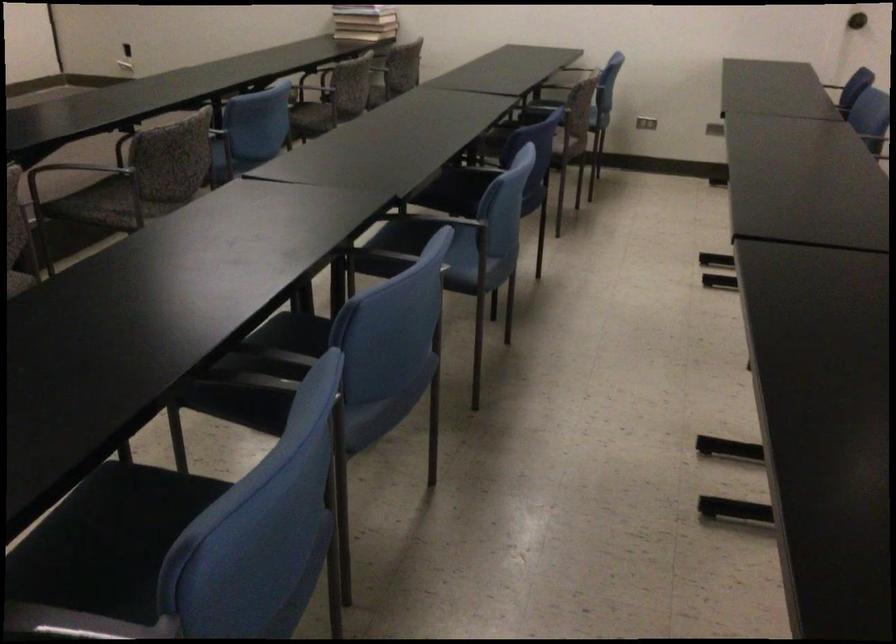
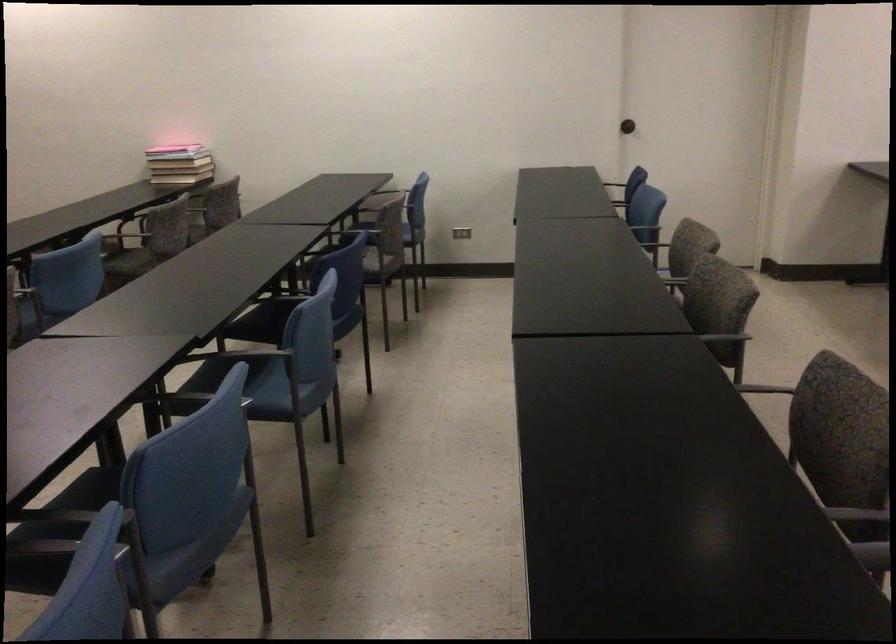
Question: How did the camera likely rotate?

Choices:
 (A) Left
 (B) Right
 (C) Up
 (D) Down

Answer: (B)